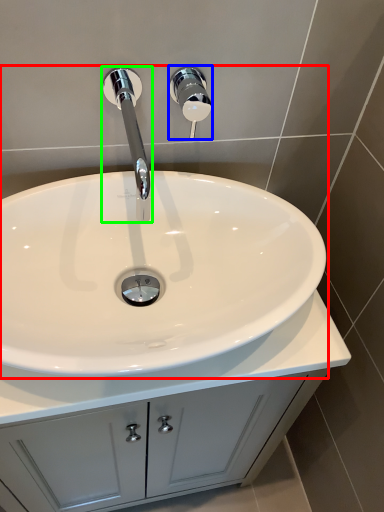
Question: Which object is positioned closest to sink (highlighted by a red box)? Select from shower (highlighted by a blue box) and tap (highlighted by a green box).

Choices:
 (A) shower
 (B) tap

Answer: (B)